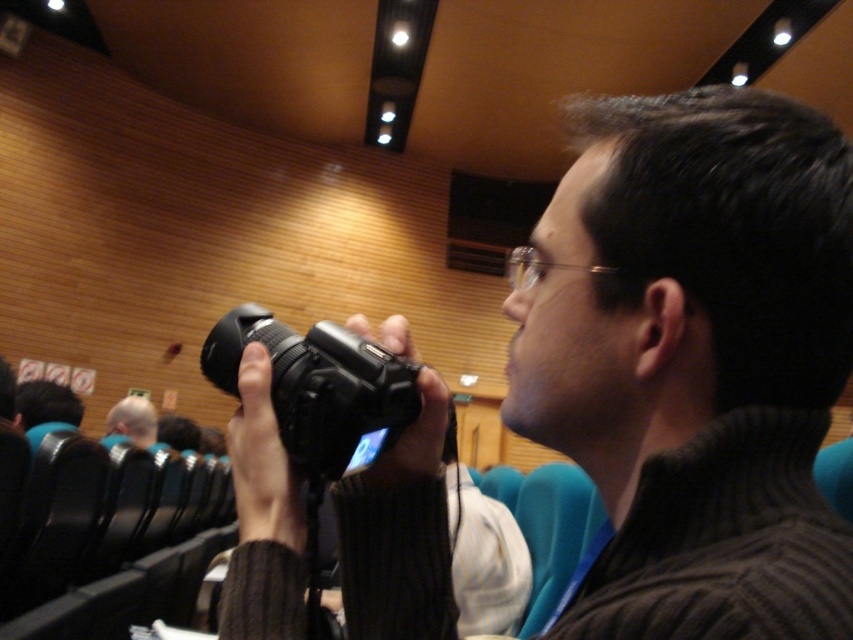
Based on the photo, is the position of black plastic camera at center less distant than that of light blue shirt at center?

Yes, black plastic camera at center is in front of light blue shirt at center.

In the scene shown: Who is lower down, black plastic camera at center or light blue shirt at center?

light blue shirt at center is below.

What do you see at coordinates (318, 388) in the screenshot? The image size is (853, 640). I see `black plastic camera at center` at bounding box center [318, 388].

At what (x,y) coordinates should I click in order to perform the action: click on black plastic camera at center. Please return your answer as a coordinate pair (x, y). The height and width of the screenshot is (640, 853). Looking at the image, I should click on (318, 388).

Locate an element on the screen. The image size is (853, 640). black plastic camera at center is located at coordinates (318, 388).

Who is positioned more to the left, black plastic camera at center or matte black camera at center?

matte black camera at center is more to the left.

Where is `black plastic camera at center`? black plastic camera at center is located at coordinates (318, 388).

Who is positioned more to the right, black matte camera at center or light blue shirt at center?

black matte camera at center is more to the right.

Does point (612, 392) come closer to viewer compared to point (152, 440)?

Yes, point (612, 392) is in front of point (152, 440).

Which is behind, point (714, 218) or point (144, 428)?

Point (144, 428)

Find the location of a particular element. The width and height of the screenshot is (853, 640). black matte camera at center is located at coordinates (694, 362).